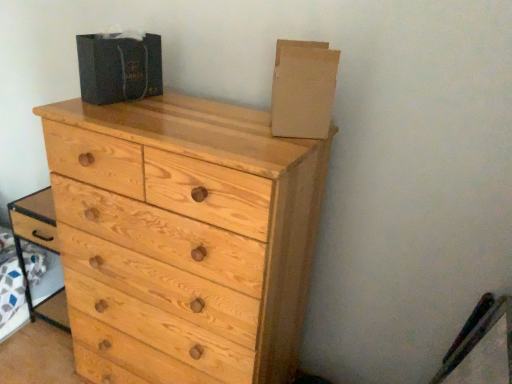
Question: Is dark gray cardboard box at upper center, which is counted as the second cardboard box, starting from the right, bigger or smaller than cardboard at upper right, placed as the 2th cardboard box when sorted from left to right?

Choices:
 (A) small
 (B) big

Answer: (B)

Question: Is dark gray cardboard box at upper center, which is counted as the second cardboard box, starting from the right, inside or outside of cardboard at upper right, placed as the 2th cardboard box when sorted from left to right?

Choices:
 (A) outside
 (B) inside

Answer: (A)

Question: Which is farther from the cardboard at upper right, which is counted as the 1th cardboard box, starting from the right?

Choices:
 (A) dark gray cardboard box at upper center, which is counted as the second cardboard box, starting from the right
 (B) light wood chest of drawers at center

Answer: (A)

Question: Estimate the real-world distances between objects in this image. Which object is farther from the cardboard at upper right, which is counted as the 1th cardboard box, starting from the right?

Choices:
 (A) dark gray cardboard box at upper center, which is counted as the second cardboard box, starting from the right
 (B) light wood chest of drawers at center

Answer: (A)